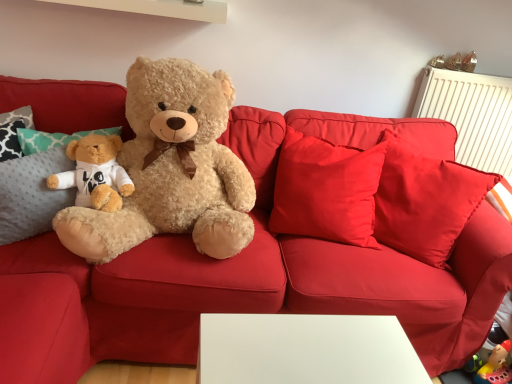
Question: Could you tell me if fluffy beige teddy bear at left is turned towards matte brown teddy bear at upper right, which appears as the first toy when viewed from the left?

Choices:
 (A) yes
 (B) no

Answer: (B)

Question: From the image's perspective, does fluffy beige teddy bear at left appear higher than matte brown teddy bear at upper right, acting as the second toy starting from the right?

Choices:
 (A) yes
 (B) no

Answer: (B)

Question: Does fluffy beige teddy bear at left have a smaller size compared to matte brown teddy bear at upper right, which appears as the first toy when viewed from the left?

Choices:
 (A) yes
 (B) no

Answer: (B)

Question: Does fluffy beige teddy bear at left have a lesser width compared to matte brown teddy bear at upper right, acting as the second toy starting from the right?

Choices:
 (A) no
 (B) yes

Answer: (A)

Question: Is fluffy beige teddy bear at left oriented away from matte brown teddy bear at upper right, which appears as the first toy when viewed from the left?

Choices:
 (A) no
 (B) yes

Answer: (A)

Question: From a real-world perspective, does fluffy beige teddy bear at left stand above matte brown teddy bear at upper right, acting as the second toy starting from the right?

Choices:
 (A) no
 (B) yes

Answer: (A)

Question: Are matte brown teddy bear at upper right, which appears as the first toy when viewed from the left, and metallic gold earrings at upper right, positioned as the second toy in left-to-right order, making contact?

Choices:
 (A) yes
 (B) no

Answer: (A)

Question: Considering the relative sizes of matte brown teddy bear at upper right, acting as the second toy starting from the right, and metallic gold earrings at upper right, positioned as the second toy in left-to-right order, in the image provided, is matte brown teddy bear at upper right, acting as the second toy starting from the right, bigger than metallic gold earrings at upper right, positioned as the second toy in left-to-right order,?

Choices:
 (A) no
 (B) yes

Answer: (A)

Question: Does matte brown teddy bear at upper right, which appears as the first toy when viewed from the left, appear on the left side of metallic gold earrings at upper right, which is the 1th toy from right to left?

Choices:
 (A) yes
 (B) no

Answer: (A)

Question: Is matte brown teddy bear at upper right, acting as the second toy starting from the right, taller than metallic gold earrings at upper right, which is the 1th toy from right to left?

Choices:
 (A) no
 (B) yes

Answer: (A)

Question: Is matte brown teddy bear at upper right, which appears as the first toy when viewed from the left, looking in the opposite direction of metallic gold earrings at upper right, positioned as the second toy in left-to-right order?

Choices:
 (A) no
 (B) yes

Answer: (A)

Question: Does matte brown teddy bear at upper right, which appears as the first toy when viewed from the left, come in front of metallic gold earrings at upper right, which is the 1th toy from right to left?

Choices:
 (A) no
 (B) yes

Answer: (B)

Question: From the image's perspective, is fluffy beige teddy bear at left on metallic gold earrings at upper right, which is the 1th toy from right to left?

Choices:
 (A) no
 (B) yes

Answer: (A)